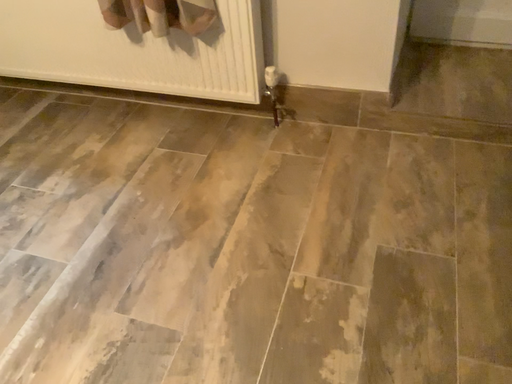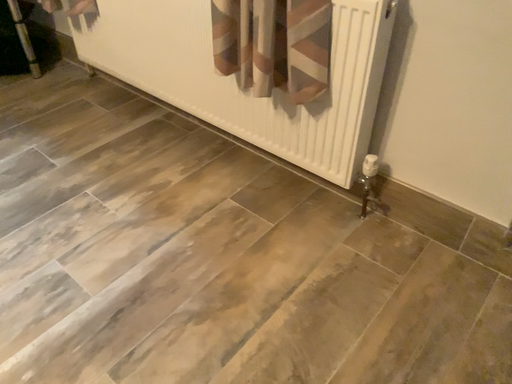
Question: Which way did the camera rotate in the video?

Choices:
 (A) rotated right
 (B) rotated left

Answer: (B)